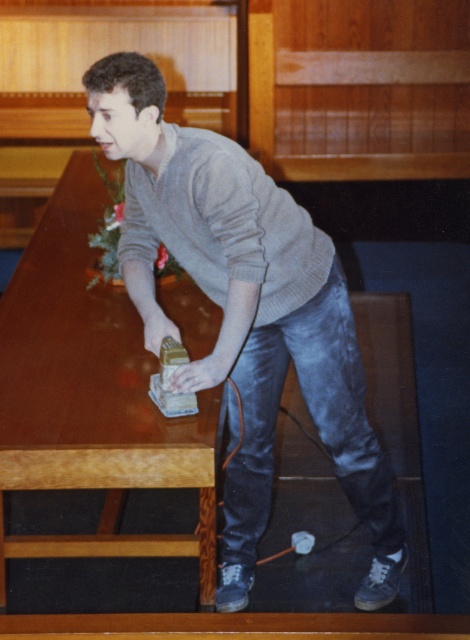
Question: Is gray wool sweater at center wider than shiny brown wood table at center?

Choices:
 (A) yes
 (B) no

Answer: (A)

Question: Which point is closer to the camera?

Choices:
 (A) gray wool sweater at center
 (B) shiny brown wood table at center

Answer: (A)

Question: Where is gray wool sweater at center located in relation to shiny brown wood table at center in the image?

Choices:
 (A) left
 (B) right

Answer: (B)

Question: In this image, where is gray wool sweater at center located relative to shiny brown wood table at center?

Choices:
 (A) left
 (B) right

Answer: (B)

Question: Which of the following is the farthest from the observer?

Choices:
 (A) shiny brown wood table at center
 (B) gray wool sweater at center

Answer: (A)